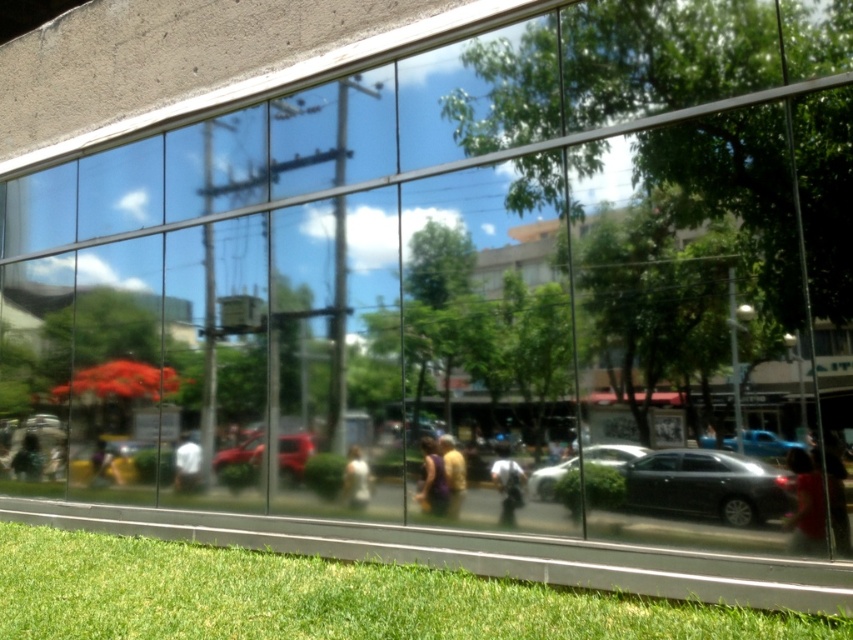
Can you confirm if dark purple fabric at center is thinner than white glossy statue at center?

Incorrect, dark purple fabric at center's width is not less than white glossy statue at center's.

Describe the element at coordinates (432, 481) in the screenshot. I see `dark purple fabric at center` at that location.

Where is `dark purple fabric at center`? The image size is (853, 640). dark purple fabric at center is located at coordinates (432, 481).

Can you confirm if shiny red car at center is positioned above dark purple fabric at center?

No, shiny red car at center is not above dark purple fabric at center.

Between shiny red car at center and dark purple fabric at center, which one appears on the right side from the viewer's perspective?

dark purple fabric at center is more to the right.

Describe the element at coordinates (294, 452) in the screenshot. The height and width of the screenshot is (640, 853). I see `shiny red car at center` at that location.

Image resolution: width=853 pixels, height=640 pixels. I want to click on shiny red car at center, so click(294, 452).

From the picture: Does matte black sedan at lower right appear over blurred fabric person at lower left?

Indeed, matte black sedan at lower right is positioned over blurred fabric person at lower left.

This screenshot has height=640, width=853. In order to click on matte black sedan at lower right in this screenshot , I will do `click(708, 486)`.

At what (x,y) coordinates should I click in order to perform the action: click on matte black sedan at lower right. Please return your answer as a coordinate pair (x, y). The height and width of the screenshot is (640, 853). Looking at the image, I should click on (708, 486).